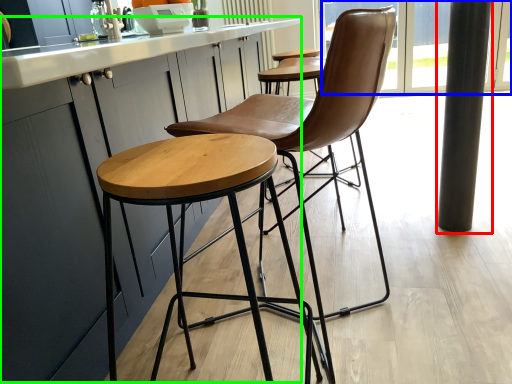
Question: Estimate the real-world distances between objects in this image. Which object is closer to pillar (highlighted by a red box), window screen (highlighted by a blue box) or counter top (highlighted by a green box)?

Choices:
 (A) window screen
 (B) counter top

Answer: (B)